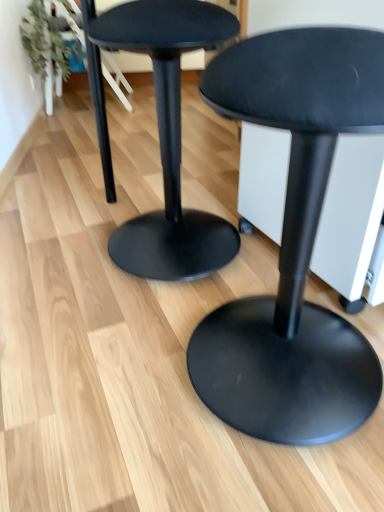
Question: From a real-world perspective, is matte black stool at center, the 1th stool positioned from the right, above or below matte black stool at center, the first stool viewed from the left?

Choices:
 (A) above
 (B) below

Answer: (B)

Question: Considering the positions of matte black stool at center, marked as the second stool in a left-to-right arrangement, and matte black stool at center, which appears as the 2th stool when viewed from the right, in the image, is matte black stool at center, marked as the second stool in a left-to-right arrangement, taller or shorter than matte black stool at center, which appears as the 2th stool when viewed from the right,?

Choices:
 (A) short
 (B) tall

Answer: (B)

Question: In the image, is matte black stool at center, the 1th stool positioned from the right, positioned in front of or behind matte black stool at center, the first stool viewed from the left?

Choices:
 (A) front
 (B) behind

Answer: (A)

Question: From a real-world perspective, is matte black stool at center, which appears as the 2th stool when viewed from the right, positioned above or below matte black stool at center, the 1th stool positioned from the right?

Choices:
 (A) below
 (B) above

Answer: (B)

Question: Considering their positions, is matte black stool at center, which appears as the 2th stool when viewed from the right, located in front of or behind matte black stool at center, the 1th stool positioned from the right?

Choices:
 (A) front
 (B) behind

Answer: (B)

Question: Is point (180, 95) closer or farther from the camera than point (274, 114)?

Choices:
 (A) farther
 (B) closer

Answer: (A)

Question: From the image's perspective, is matte black stool at center, which appears as the 2th stool when viewed from the right, positioned above or below matte black stool at center, marked as the second stool in a left-to-right arrangement?

Choices:
 (A) below
 (B) above

Answer: (B)